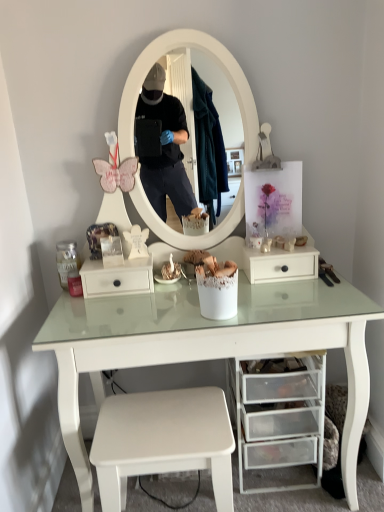
Find the location of a particular element. This screenshot has width=384, height=512. transparent plastic drawers at lower center, the 1th drawer from the right is located at coordinates (280, 414).

In order to click on white matte stool at lower center in this screenshot , I will do `click(163, 441)`.

Which object is closer to the camera, white matte stool at lower center or white matte drawer at center, the 2th drawer from the right?

white matte stool at lower center is more forward.

Is white matte stool at lower center bigger or smaller than white matte drawer at center, acting as the first drawer starting from the top?

white matte stool at lower center is bigger than white matte drawer at center, acting as the first drawer starting from the top.

Are white matte stool at lower center and white matte drawer at center, which appears as the second drawer when ordered from the bottom, far apart?

No, there isn't a large distance between white matte stool at lower center and white matte drawer at center, which appears as the second drawer when ordered from the bottom.

Is white matte stool at lower center oriented away from white matte drawer at center, acting as the first drawer starting from the top?

No, white matte stool at lower center is not facing the opposite direction of white matte drawer at center, acting as the first drawer starting from the top.

Is white matte stool at lower center facing away from transparent plastic drawers at lower center, which is the second drawer from left to right?

white matte stool at lower center is not turned away from transparent plastic drawers at lower center, which is the second drawer from left to right.

From the image's perspective, is white matte stool at lower center below transparent plastic drawers at lower center, which is the second drawer from left to right?

Indeed, from the image's perspective, white matte stool at lower center is shown beneath transparent plastic drawers at lower center, which is the second drawer from left to right.

Is white matte stool at lower center not within transparent plastic drawers at lower center, the second drawer viewed from the top?

white matte stool at lower center is positioned outside transparent plastic drawers at lower center, the second drawer viewed from the top.

Considering the sizes of objects white matte stool at lower center and transparent plastic drawers at lower center, the second drawer viewed from the top, in the image provided, who is bigger, white matte stool at lower center or transparent plastic drawers at lower center, the second drawer viewed from the top,?

Bigger between the two is transparent plastic drawers at lower center, the second drawer viewed from the top.

In the scene shown: From a real-world perspective, between white matte drawer at center, acting as the first drawer starting from the top, and white matte stool at lower center, who is vertically lower?

white matte stool at lower center is physically lower.

Is white matte stool at lower center at the back of white matte drawer at center, which is counted as the first drawer, starting from the left?

No, white matte drawer at center, which is counted as the first drawer, starting from the left, is not facing away from white matte stool at lower center.

Does white matte drawer at center, which appears as the second drawer when ordered from the bottom, have a lesser height compared to white matte stool at lower center?

Yes.

Can you confirm if transparent plastic drawers at lower center, which ranks as the 1th drawer in bottom-to-top order, is shorter than white matte drawer at center, the 2th drawer from the right?

No.

From the picture: Is transparent plastic drawers at lower center, the 1th drawer from the right, smaller than white matte drawer at center, which appears as the second drawer when ordered from the bottom?

Incorrect, transparent plastic drawers at lower center, the 1th drawer from the right, is not smaller in size than white matte drawer at center, which appears as the second drawer when ordered from the bottom.

Is transparent plastic drawers at lower center, the 1th drawer from the right, oriented towards white matte drawer at center, the 2th drawer from the right?

No, transparent plastic drawers at lower center, the 1th drawer from the right, is not turned towards white matte drawer at center, the 2th drawer from the right.

Considering the relative sizes of transparent plastic drawers at lower center, which ranks as the 1th drawer in bottom-to-top order, and white matte drawer at center, which is counted as the first drawer, starting from the left, in the image provided, is transparent plastic drawers at lower center, which ranks as the 1th drawer in bottom-to-top order, wider than white matte drawer at center, which is counted as the first drawer, starting from the left,?

Yes.

Which is behind, white matte drawer at center, acting as the first drawer starting from the top, or transparent plastic drawers at lower center, the 1th drawer from the right?

white matte drawer at center, acting as the first drawer starting from the top, is further away from the camera.

Considering the relative sizes of white matte drawer at center, which appears as the second drawer when ordered from the bottom, and transparent plastic drawers at lower center, the second drawer viewed from the top, in the image provided, is white matte drawer at center, which appears as the second drawer when ordered from the bottom, thinner than transparent plastic drawers at lower center, the second drawer viewed from the top,?

Correct, the width of white matte drawer at center, which appears as the second drawer when ordered from the bottom, is less than that of transparent plastic drawers at lower center, the second drawer viewed from the top.

Find the location of a particular element. The width and height of the screenshot is (384, 512). drawer below the white matte drawer at center, which is counted as the first drawer, starting from the left (from the image's perspective) is located at coordinates (280, 414).

Is white matte drawer at center, which is counted as the first drawer, starting from the left, spatially inside transparent plastic drawers at lower center, which ranks as the 1th drawer in bottom-to-top order, or outside of it?

white matte drawer at center, which is counted as the first drawer, starting from the left, cannot be found inside transparent plastic drawers at lower center, which ranks as the 1th drawer in bottom-to-top order.

Does transparent plastic drawers at lower center, the second drawer viewed from the top, have a greater width compared to white matte stool at lower center?

Yes.

From the picture: Is transparent plastic drawers at lower center, which ranks as the 1th drawer in bottom-to-top order, to the left or to the right of white matte stool at lower center in the image?

transparent plastic drawers at lower center, which ranks as the 1th drawer in bottom-to-top order, is positioned on white matte stool at lower center's right side.

The image size is (384, 512). In order to click on drawer that is the 2nd one when counting backward from the white matte stool at lower center in this screenshot , I will do `click(117, 277)`.

You are a GUI agent. You are given a task and a screenshot of the screen. Output one action in this format:
    pyautogui.click(x=<x>, y=<y>)
    Task: Click on the drawer that is the 1st one when counting upward from the white matte stool at lower center (from the image's perspective)
    This screenshot has height=512, width=384.
    Given the screenshot: What is the action you would take?
    pyautogui.click(x=280, y=414)

Based on their spatial positions, is white matte stool at lower center or white matte drawer at center, acting as the first drawer starting from the top, closer to transparent plastic drawers at lower center, the 1th drawer from the right?

The object closer to transparent plastic drawers at lower center, the 1th drawer from the right, is white matte stool at lower center.

When comparing their distances from transparent plastic drawers at lower center, the second drawer viewed from the top, does white matte drawer at center, acting as the first drawer starting from the top, or white matte stool at lower center seem further?

white matte drawer at center, acting as the first drawer starting from the top.

Considering their positions, is white matte stool at lower center positioned closer to white matte drawer at center, which appears as the second drawer when ordered from the bottom, than transparent plastic drawers at lower center, which is the second drawer from left to right?

white matte stool at lower center.

Estimate the real-world distances between objects in this image. Which object is further from white matte drawer at center, acting as the first drawer starting from the top, transparent plastic drawers at lower center, the 1th drawer from the right, or white matte stool at lower center?

Among the two, transparent plastic drawers at lower center, the 1th drawer from the right, is located further to white matte drawer at center, acting as the first drawer starting from the top.

When comparing their distances from white matte stool at lower center, does white matte drawer at center, the 2th drawer from the right, or transparent plastic drawers at lower center, which is the second drawer from left to right, seem closer?

transparent plastic drawers at lower center, which is the second drawer from left to right, is closer to white matte stool at lower center.

Based on their spatial positions, is transparent plastic drawers at lower center, which is the second drawer from left to right, or white matte drawer at center, the 2th drawer from the right, closer to white matte stool at lower center?

transparent plastic drawers at lower center, which is the second drawer from left to right.

This screenshot has width=384, height=512. In order to click on drawer between white matte drawer at center, which appears as the second drawer when ordered from the bottom, and white matte stool at lower center vertically in this screenshot , I will do tap(280, 414).